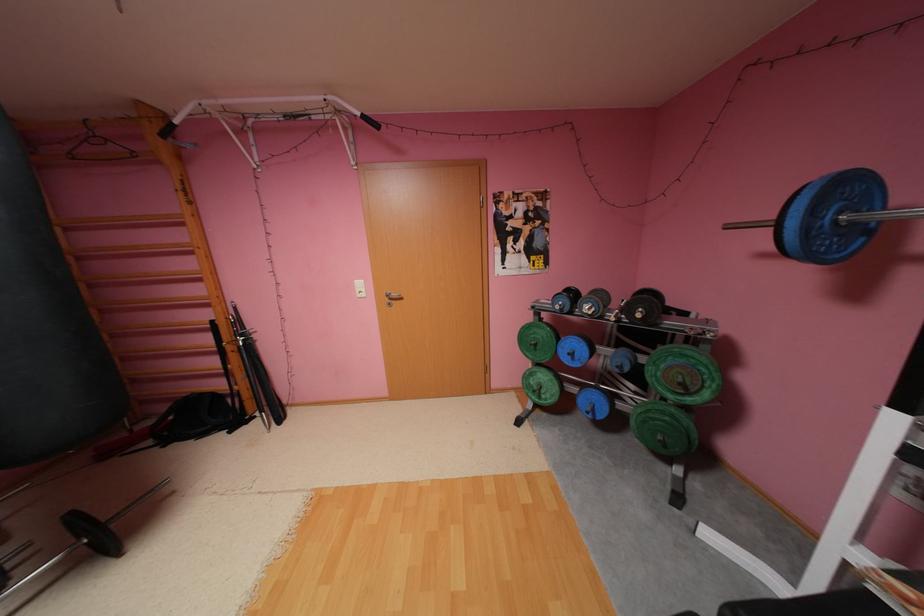
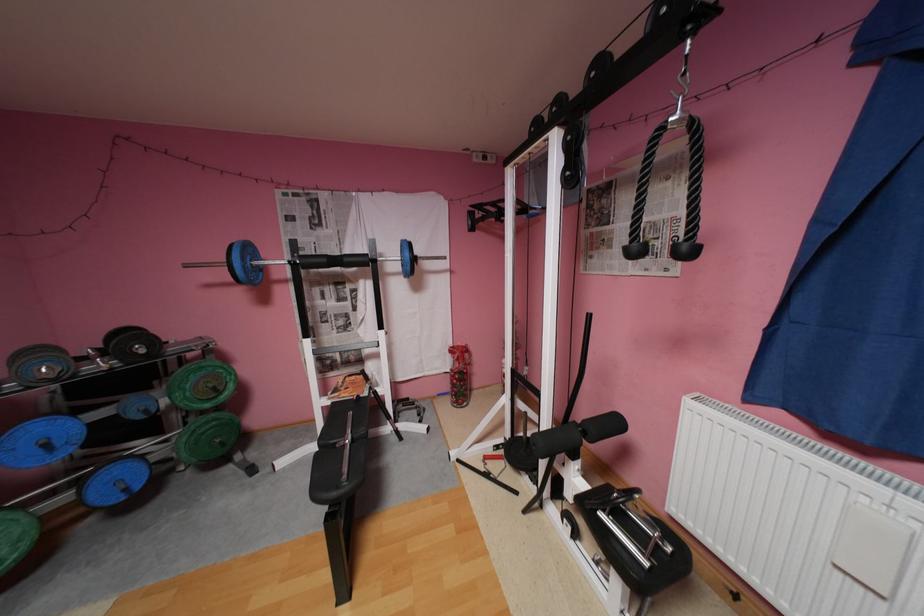
The point at (690, 384) is marked in the first image. Where is the corresponding point in the second image?

(224, 387)